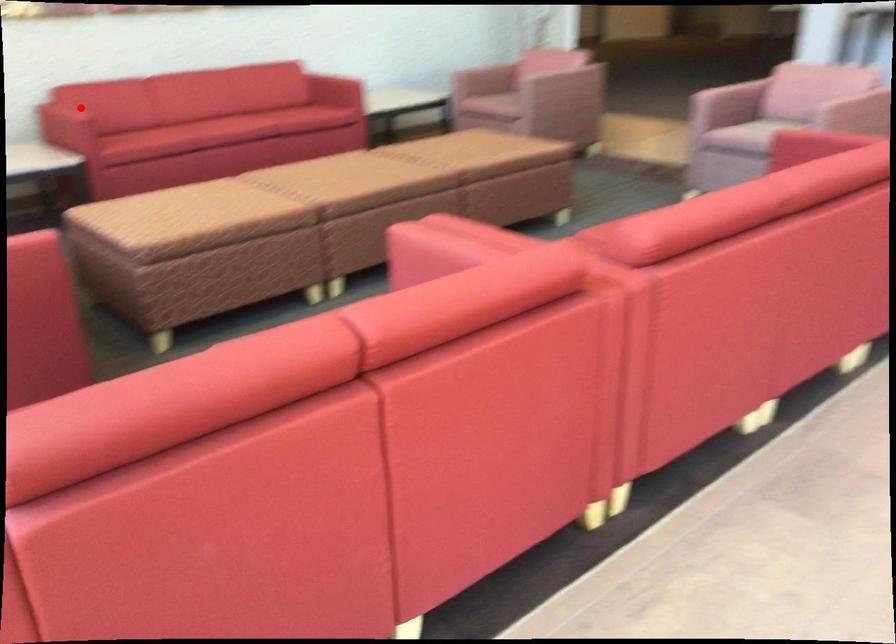
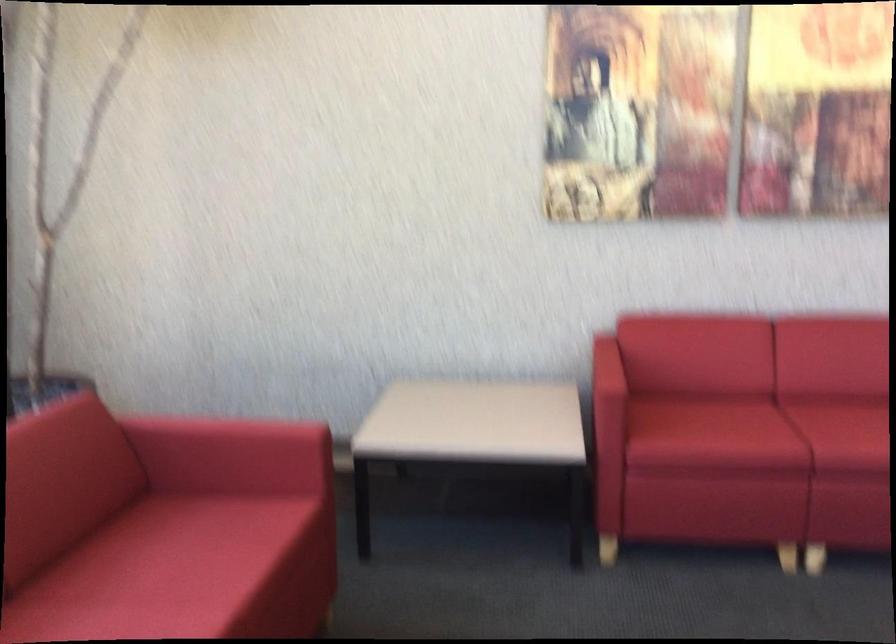
Question: I am providing you with two images of the same scene from different viewpoints. Image1 has a red point marked. In image2, the corresponding 3D location appears at what relative position? Reply with the corresponding letter.

Choices:
 (A) Closer
 (B) Farther

Answer: (A)